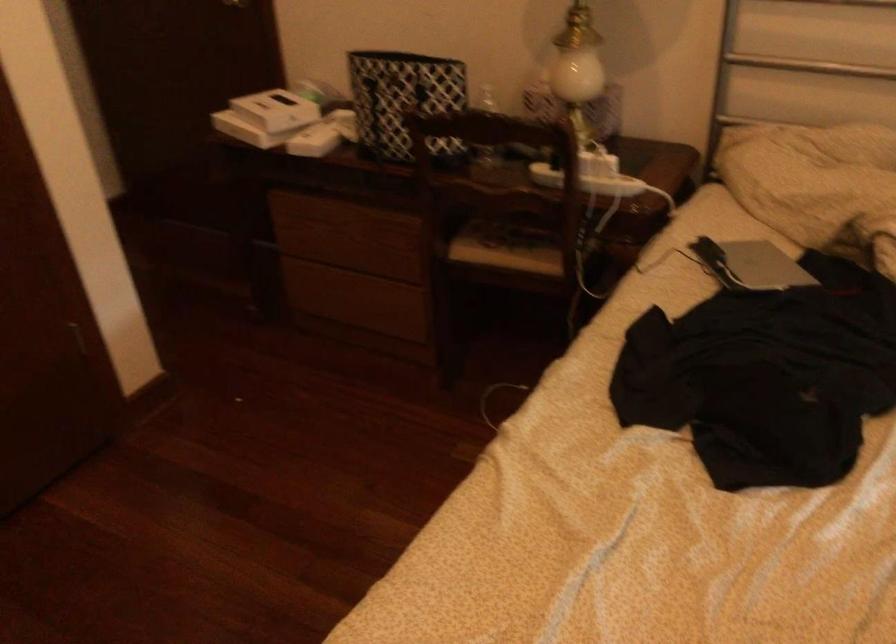
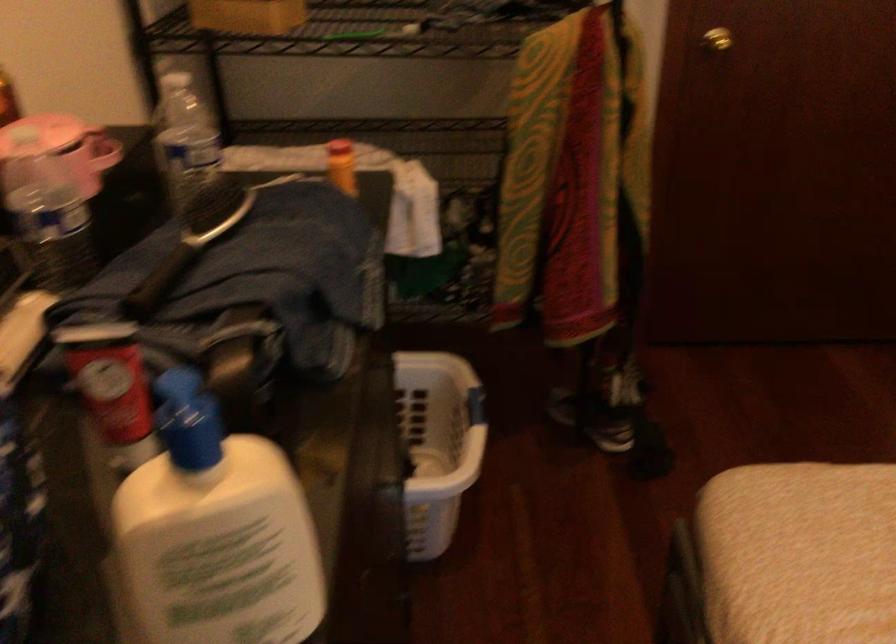
How did the camera likely rotate?

The camera's rotation is toward left-down.